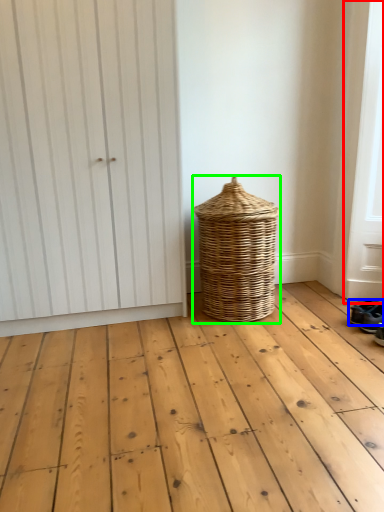
Question: Which object is the farthest from screen door (highlighted by a red box)? Choose among these: footwear (highlighted by a blue box) or basket (highlighted by a green box).

Choices:
 (A) footwear
 (B) basket

Answer: (B)